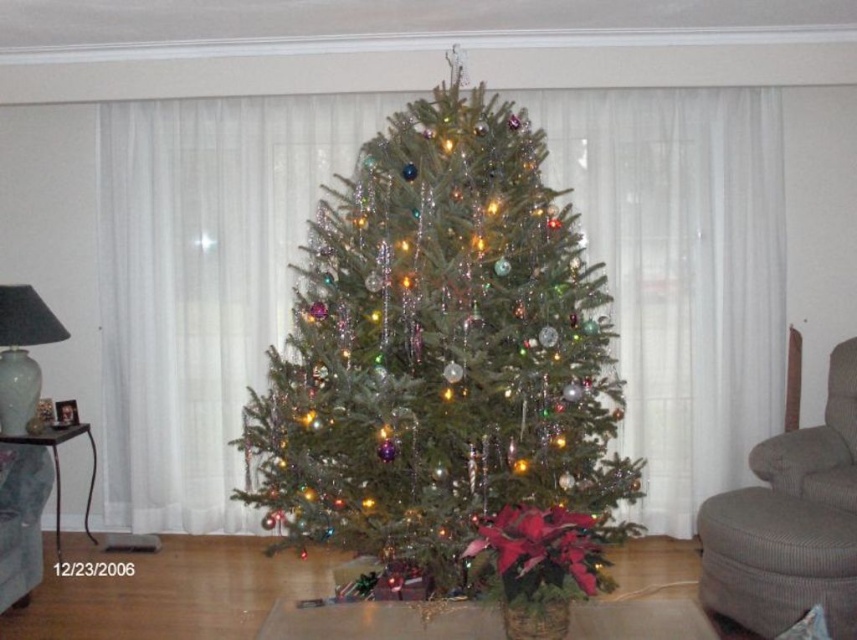
You are sitting in the gray fabric armchair at right and want to see the green textured christmas tree at center. Can you see the tree without moving your head?

Yes, because the green textured christmas tree at center is in front of the gray fabric armchair at right, so it should be directly visible from your seated position in the armchair.

You are a guest entering the living room and want to place your gift under the Christmas tree. The gift is 1.2 meters wide. Is there enough space between the red velvet poinsettia at lower center and the gray fabric armchair at lower left to place it?

The red velvet poinsettia at lower center is to the right of the gray fabric armchair at lower left, but the distance between them isn

You are a guest entering the living room and want to sit comfortably. Given that the gray fabric armchair at right is the only seating available, will it be large enough to accommodate you comfortably compared to the red velvet poinsettia at lower center?

The gray fabric armchair at right is larger in size than the red velvet poinsettia at lower center, so it should be large enough to accommodate you comfortably.